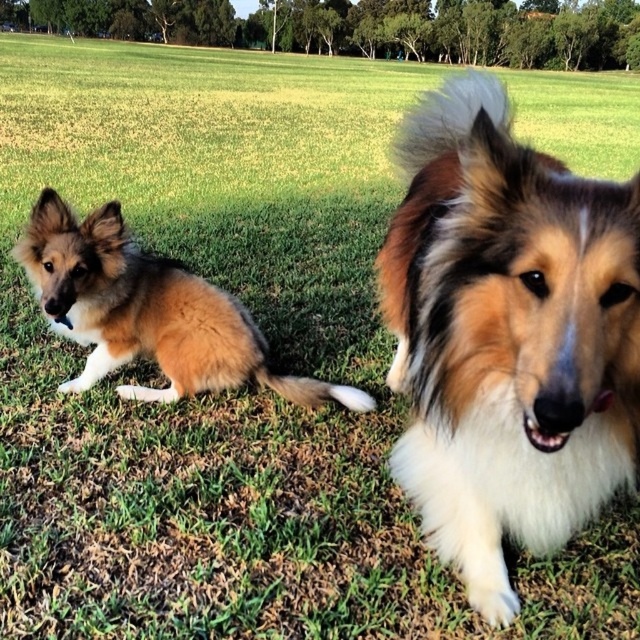
Question: Observing the image, what is the correct spatial positioning of fluffy brown dog at center in reference to brown fluffy dog at left?

Choices:
 (A) left
 (B) right

Answer: (B)

Question: Does fluffy brown dog at center appear under brown fluffy dog at left?

Choices:
 (A) yes
 (B) no

Answer: (B)

Question: Is fluffy brown dog at center closer to camera compared to brown fluffy dog at left?

Choices:
 (A) no
 (B) yes

Answer: (B)

Question: Which point is farther to the camera?

Choices:
 (A) tap(461, 177)
 (B) tap(173, 380)

Answer: (B)